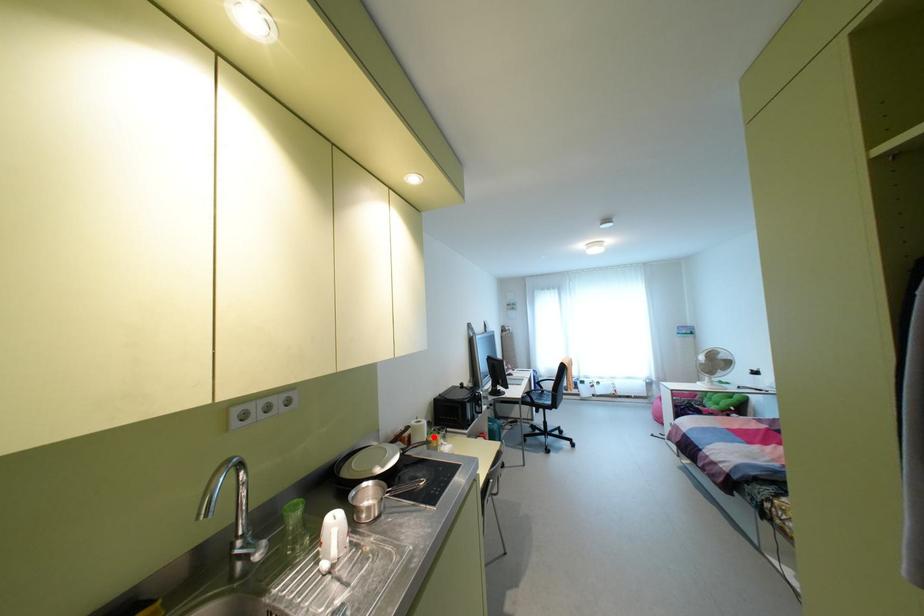
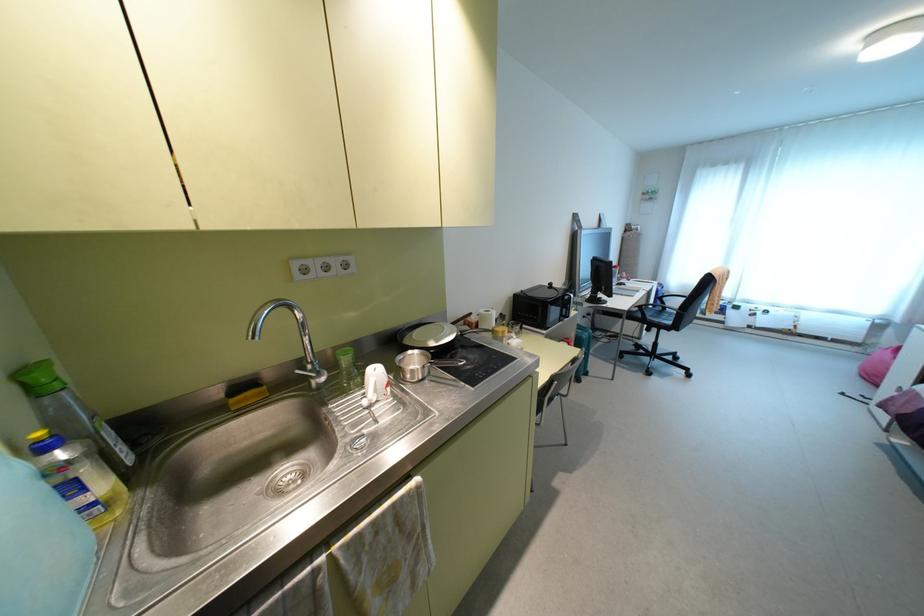
The point at the highlighted location is marked in the first image. Where is the corresponding point in the second image?

(500, 328)